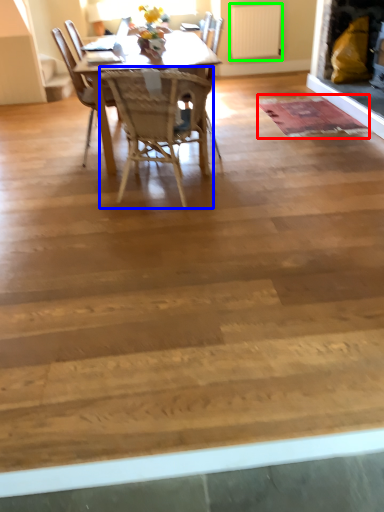
Question: Which is farther away from mat (highlighted by a red box)? chair (highlighted by a blue box) or radiator (highlighted by a green box)?

Choices:
 (A) chair
 (B) radiator

Answer: (B)